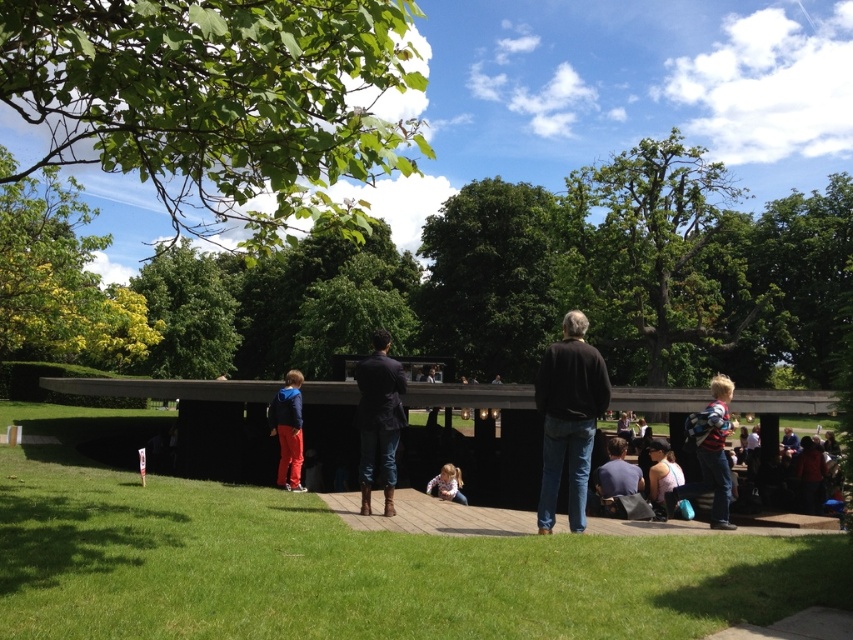
You are standing at the entrance of the park and see the dark brown leather boots at center and the dark blue shirt at center. Which one is closer to you?

The dark brown leather boots at center is in front of the dark blue shirt at center, so it is closer to you.

You are planning to place a small bench between the matte blue jacket at center and the light pink fabric at center. Based on their widths, which object should the bench be closer to?

The bench should be placed closer to the light pink fabric at center because the matte blue jacket at center is wider and may require more space.

You are standing at the entrance of the park and see the dark brown leather boots at center. Can you determine if the boots are closer to the grassy area or the paved pathway?

The dark brown leather boots at center are located at point (379, 419), which places them closer to the paved pathway than the grassy area.